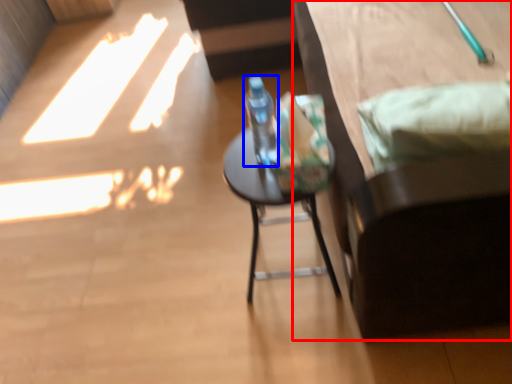
Question: Which object is further to the camera taking this photo, furniture (highlighted by a red box) or bottle (highlighted by a blue box)?

Choices:
 (A) furniture
 (B) bottle

Answer: (B)